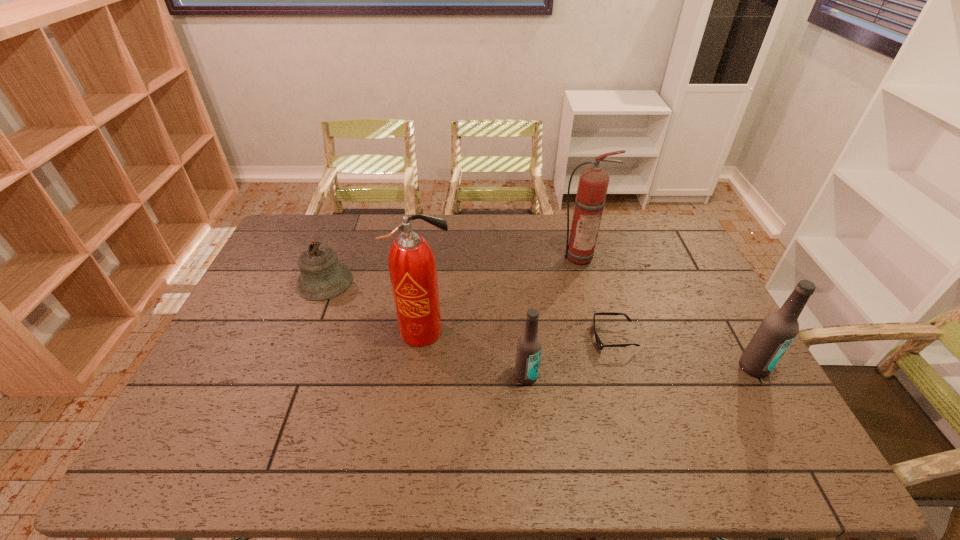
This screenshot has height=540, width=960. Identify the location of vacant space at the far edge of the desktop. (507, 214).

Find the location of `free space at the near edge`. free space at the near edge is located at coordinates click(x=715, y=421).

In the image, there is a desktop. What are the coordinates of `vacant region at the left edge` in the screenshot? It's located at point(221,368).

The height and width of the screenshot is (540, 960). In order to click on vacant area at the right edge of the desktop in this screenshot , I will do `click(707, 285)`.

Identify the location of vacant space that is in between the farther fire extinguisher and the third object from left to right. This screenshot has height=540, width=960. click(553, 316).

Identify the location of vacant region between the fourth object from right to left and the shortest object. The image size is (960, 540). (569, 357).

I want to click on unoccupied area between the right fire extinguisher and the leftmost object, so click(452, 269).

Where is `free space between the right fire extinguisher and the sunglasses`? free space between the right fire extinguisher and the sunglasses is located at coordinates (596, 296).

I want to click on vacant area that lies between the farther fire extinguisher and the nearer fire extinguisher, so click(x=501, y=293).

You are a GUI agent. You are given a task and a screenshot of the screen. Output one action in this format:
    pyautogui.click(x=<x>, y=<y>)
    Task: Click on the vacant space in between the shorter beer bottle and the nearer fire extinguisher
    The height and width of the screenshot is (540, 960).
    Given the screenshot: What is the action you would take?
    pyautogui.click(x=475, y=354)